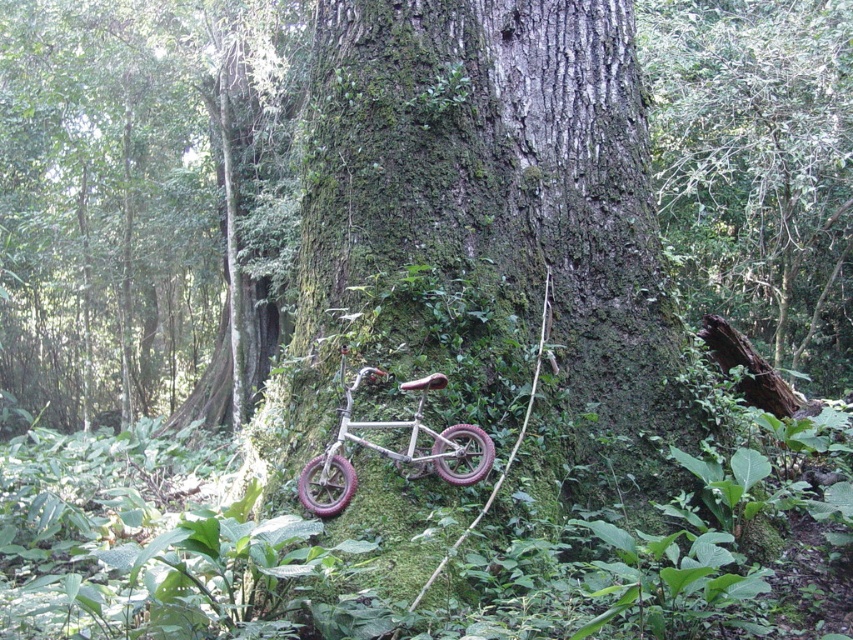
Question: Which object is the farthest from the green mossy tree at center?

Choices:
 (A) metallic matte bicycle at center
 (B) smooth bark tree at center
 (C) green mossy bark at center

Answer: (A)

Question: Considering the relative positions of green mossy bark at center and metallic matte bicycle at center in the image provided, where is green mossy bark at center located with respect to metallic matte bicycle at center?

Choices:
 (A) above
 (B) below

Answer: (A)

Question: Can you confirm if green mossy tree at center is bigger than smooth bark tree at center?

Choices:
 (A) no
 (B) yes

Answer: (B)

Question: Is green mossy tree at center to the right of metallic matte bicycle at center from the viewer's perspective?

Choices:
 (A) no
 (B) yes

Answer: (A)

Question: Which point appears farthest from the camera in this image?

Choices:
 (A) (316, 500)
 (B) (55, 221)
 (C) (645, 211)

Answer: (B)

Question: Which is nearer to the metallic matte bicycle at center?

Choices:
 (A) green mossy tree at center
 (B) smooth bark tree at center

Answer: (B)